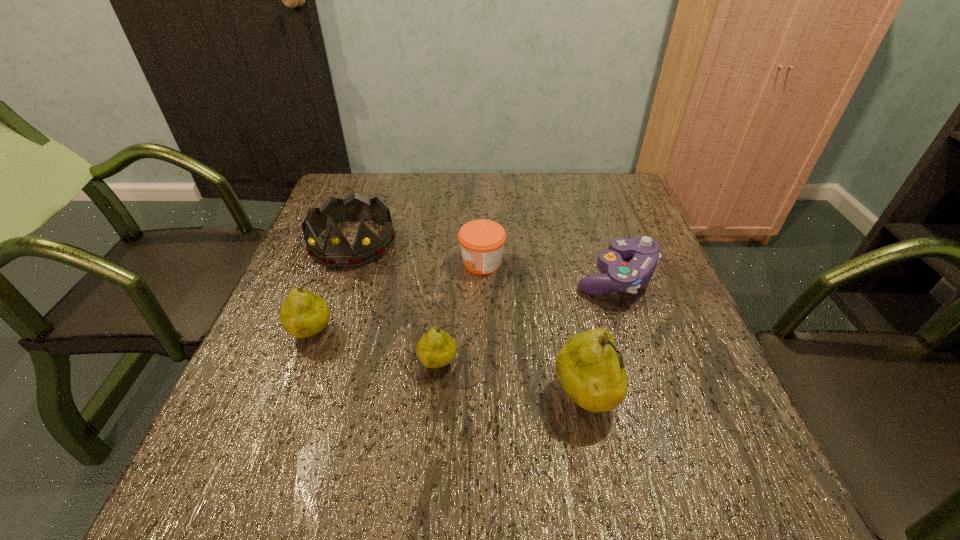
In the image, there is a desktop. At what (x,y) coordinates should I click in order to perform the action: click on vacant area at the far edge. Please return your answer as a coordinate pair (x, y). The image size is (960, 540). Looking at the image, I should click on (458, 174).

In the image, there is a desktop. At what (x,y) coordinates should I click in order to perform the action: click on vacant space at the near edge. Please return your answer as a coordinate pair (x, y). This screenshot has width=960, height=540. Looking at the image, I should click on (465, 427).

In the image, there is a desktop. Where is `vacant space at the left edge`? The width and height of the screenshot is (960, 540). vacant space at the left edge is located at coordinates (322, 273).

You are a GUI agent. You are given a task and a screenshot of the screen. Output one action in this format:
    pyautogui.click(x=<x>, y=<y>)
    Task: Click on the free spot at the right edge of the desktop
    
    Given the screenshot: What is the action you would take?
    pyautogui.click(x=619, y=229)

At what (x,y) coordinates should I click in order to perform the action: click on blank space at the far right corner of the desktop. Please return your answer as a coordinate pair (x, y). This screenshot has height=540, width=960. Looking at the image, I should click on (618, 176).

At what (x,y) coordinates should I click in order to perform the action: click on vacant space that is in between the control and the second pear from left to right. Please return your answer as a coordinate pair (x, y). The height and width of the screenshot is (540, 960). Looking at the image, I should click on (527, 320).

The width and height of the screenshot is (960, 540). I want to click on vacant area that lies between the control and the shortest pear, so click(x=527, y=320).

In order to click on free space between the shortest pear and the control in this screenshot , I will do `click(527, 320)`.

This screenshot has width=960, height=540. In order to click on empty space between the rightmost pear and the shortest pear in this screenshot , I will do `click(512, 381)`.

Locate an element on the screen. The width and height of the screenshot is (960, 540). blank region between the tiara and the third tallest object is located at coordinates (332, 288).